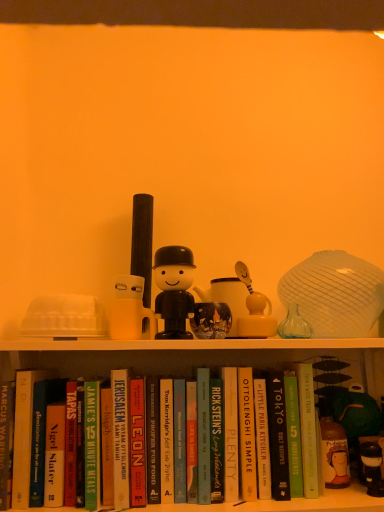
Question: Does hardcover book at center, acting as the fourth paperback book starting from the right, have a lesser width compared to hardcover book at center, marked as the third paperback book in a right-to-left arrangement?

Choices:
 (A) yes
 (B) no

Answer: (A)

Question: From the image's perspective, would you say hardcover book at center, acting as the fourth paperback book starting from the right, is shown under hardcover book at center, marked as the ninth paperback book in a left-to-right arrangement?

Choices:
 (A) no
 (B) yes

Answer: (A)

Question: Is hardcover book at center, which is the 8th paperback book from left to right, to the right of hardcover book at center, marked as the third paperback book in a right-to-left arrangement, from the viewer's perspective?

Choices:
 (A) no
 (B) yes

Answer: (A)

Question: From the image's perspective, is hardcover book at center, which is the 8th paperback book from left to right, on top of hardcover book at center, marked as the ninth paperback book in a left-to-right arrangement?

Choices:
 (A) yes
 (B) no

Answer: (A)

Question: Is hardcover book at center, which is the 8th paperback book from left to right, not within hardcover book at center, marked as the ninth paperback book in a left-to-right arrangement?

Choices:
 (A) yes
 (B) no

Answer: (A)

Question: From their relative heights in the image, would you say matte glass mug at center, acting as the 2th toy starting from the left, is taller or shorter than hardcover book at center, marked as the ninth paperback book in a left-to-right arrangement?

Choices:
 (A) short
 (B) tall

Answer: (A)

Question: Considering the positions of matte glass mug at center, acting as the 2th toy starting from the left, and hardcover book at center, marked as the ninth paperback book in a left-to-right arrangement, in the image, is matte glass mug at center, acting as the 2th toy starting from the left, wider or thinner than hardcover book at center, marked as the ninth paperback book in a left-to-right arrangement,?

Choices:
 (A) wide
 (B) thin

Answer: (B)

Question: Is matte glass mug at center, marked as the 1th toy in a right-to-left arrangement, to the left or to the right of hardcover book at center, marked as the third paperback book in a right-to-left arrangement, in the image?

Choices:
 (A) left
 (B) right

Answer: (A)

Question: From a real-world perspective, is matte glass mug at center, acting as the 2th toy starting from the left, physically located above or below hardcover book at center, marked as the third paperback book in a right-to-left arrangement?

Choices:
 (A) below
 (B) above

Answer: (B)

Question: Looking at their shapes, would you say matte white candle holder at center is wider or thinner than hardcover book at center, marked as the ninth paperback book in a left-to-right arrangement?

Choices:
 (A) wide
 (B) thin

Answer: (B)

Question: Does point (132, 287) appear closer or farther from the camera than point (269, 406)?

Choices:
 (A) closer
 (B) farther

Answer: (B)

Question: From the image's perspective, is matte white candle holder at center positioned above or below hardcover book at center, marked as the ninth paperback book in a left-to-right arrangement?

Choices:
 (A) above
 (B) below

Answer: (A)

Question: Relative to hardcover book at center, marked as the ninth paperback book in a left-to-right arrangement, is matte white candle holder at center in front or behind?

Choices:
 (A) behind
 (B) front

Answer: (A)

Question: From a real-world perspective, is black matte figure at center, the 2th toy when ordered from right to left, physically located above or below hardcover book at center, which appears as the 8th paperback book when viewed from the right?

Choices:
 (A) below
 (B) above

Answer: (B)

Question: From the image's perspective, is black matte figure at center, marked as the first toy in a left-to-right arrangement, above or below hardcover book at center, which appears as the 8th paperback book when viewed from the right?

Choices:
 (A) above
 (B) below

Answer: (A)